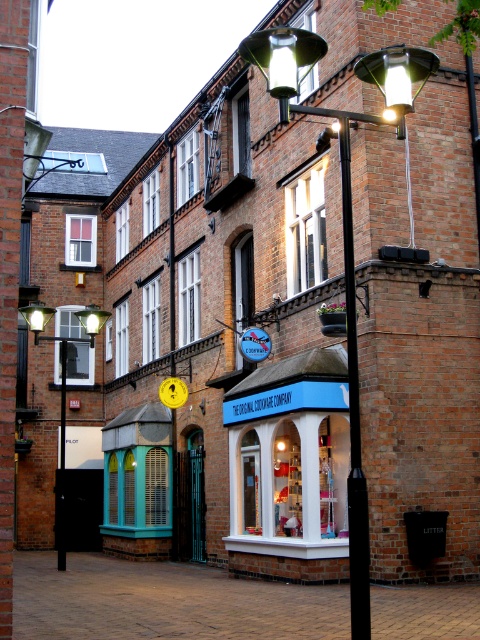
Is matte blue storefront at center smaller than matte black street light at upper left?

Yes, matte blue storefront at center is smaller than matte black street light at upper left.

Does matte blue storefront at center come behind matte black street light at upper left?

That is False.

Is point (235, 412) positioned behind point (60, 492)?

That is False.

The image size is (480, 640). Find the location of `matte blue storefront at center`. matte blue storefront at center is located at coordinates (289, 468).

Is matte blue storefront at center bigger than matte black street light at upper center?

No.

Between point (295, 573) and point (406, 76), which one is positioned in front?

Point (406, 76)

Measure the distance between matte blue storefront at center and camera.

They are 72.61 feet apart.

You are a GUI agent. You are given a task and a screenshot of the screen. Output one action in this format:
    pyautogui.click(x=<x>, y=<y>)
    Task: Click on the matte blue storefront at center
    Image resolution: width=480 pixels, height=640 pixels.
    Given the screenshot: What is the action you would take?
    pyautogui.click(x=289, y=468)

The width and height of the screenshot is (480, 640). Describe the element at coordinates (165, 602) in the screenshot. I see `brown brick pavement at lower center` at that location.

Is brown brick pavement at lower center wider than black metal pole at center?

Correct, the width of brown brick pavement at lower center exceeds that of black metal pole at center.

Between point (288, 600) and point (351, 458), which one is positioned in front?

Point (351, 458) is in front.

Where is `brown brick pavement at lower center`? This screenshot has height=640, width=480. brown brick pavement at lower center is located at coordinates (165, 602).